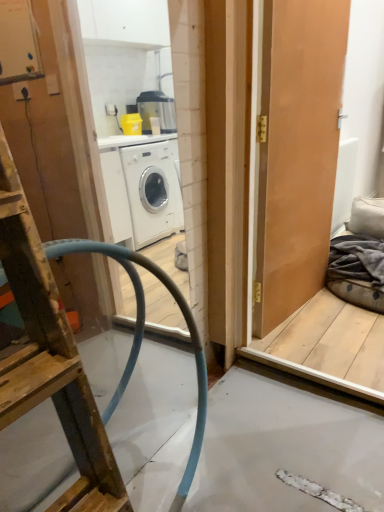
Locate an element on the screen. This screenshot has width=384, height=512. vacant space to the right of matte wooden door at right is located at coordinates (339, 312).